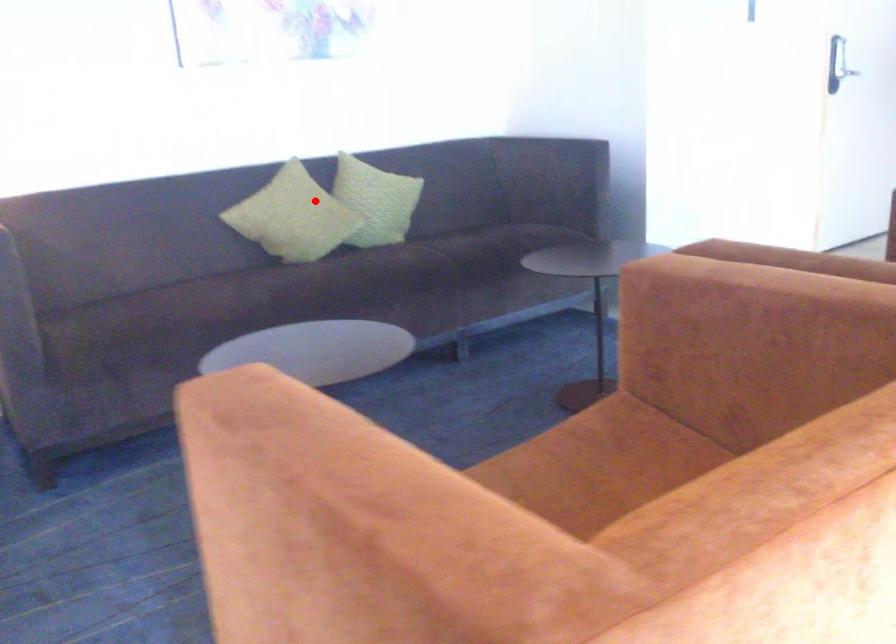
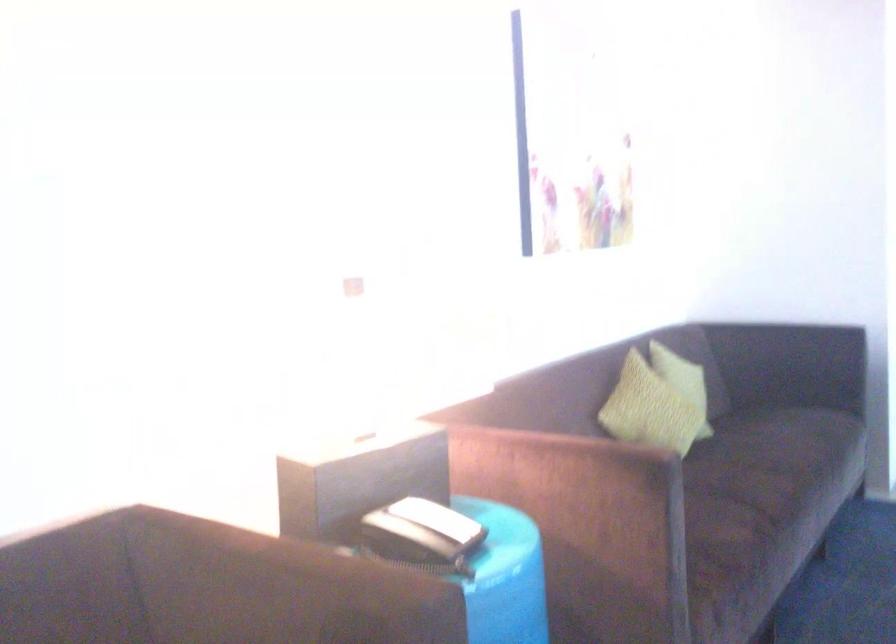
Locate, in the second image, the point that corresponds to the highlighted location in the first image.

(683, 381)